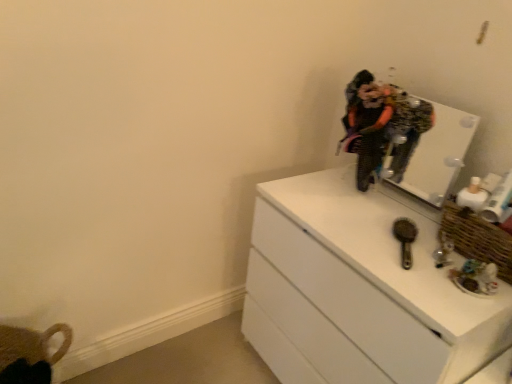
The width and height of the screenshot is (512, 384). What are the coordinates of `vacant region to the left of woven brown basket at right` in the screenshot? It's located at (406, 249).